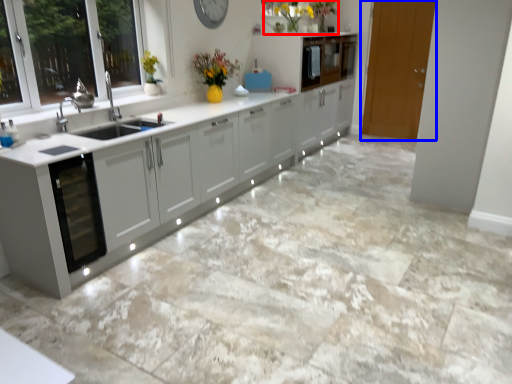
Question: Which point is further to the camera, floral arrangement (highlighted by a red box) or door (highlighted by a blue box)?

Choices:
 (A) floral arrangement
 (B) door

Answer: (B)